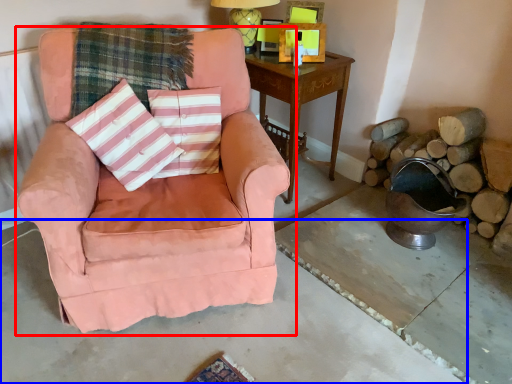
Question: Among these objects, which one is farthest to the camera, chair (highlighted by a red box) or concrete (highlighted by a blue box)?

Choices:
 (A) chair
 (B) concrete

Answer: (A)